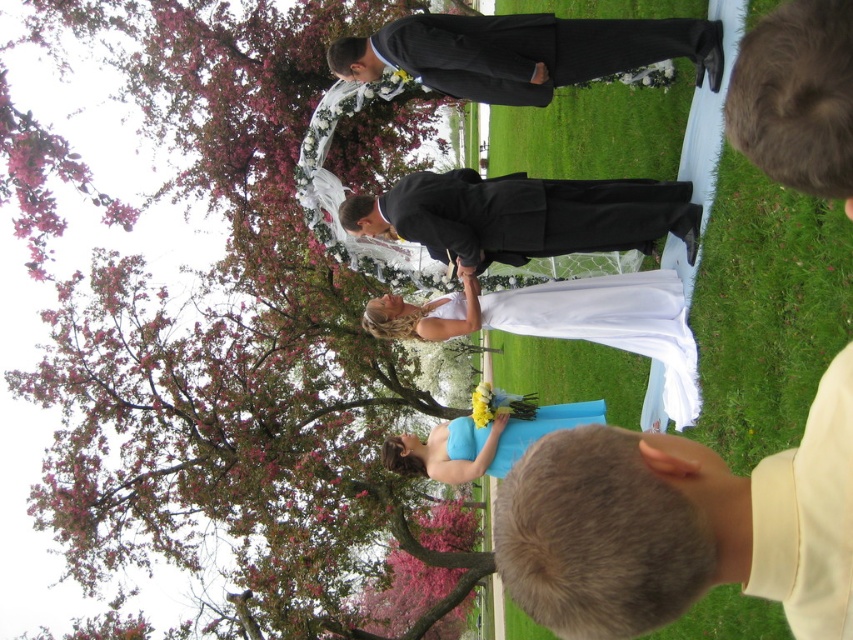
Question: Which point is farther to the camera?

Choices:
 (A) (630, 529)
 (B) (96, 304)
 (C) (554, 64)
 (D) (428, 209)

Answer: (B)

Question: Can you confirm if pink blossoming tree at upper left is positioned above black pinstripe suit at center?

Choices:
 (A) yes
 (B) no

Answer: (B)

Question: Which object is closer to the camera taking this photo?

Choices:
 (A) black pinstripe suit at center
 (B) matte black suit at center

Answer: (B)

Question: Which of these objects is positioned farthest from the matte black suit at center?

Choices:
 (A) pink blossoming tree at upper left
 (B) black satin suit at center

Answer: (A)

Question: Can you confirm if pink blossoming tree at upper left is positioned below matte black suit at center?

Choices:
 (A) no
 (B) yes

Answer: (A)

Question: Does matte black suit at center have a larger size compared to black pinstripe suit at center?

Choices:
 (A) yes
 (B) no

Answer: (B)